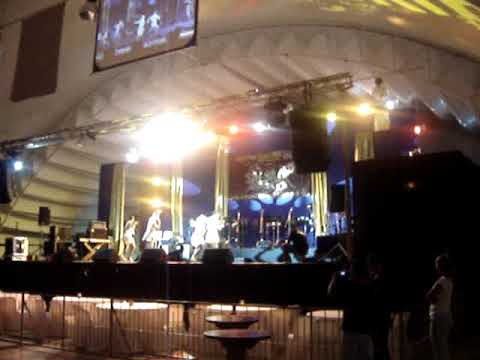
The image size is (480, 360). I want to click on screen, so click(x=141, y=32).